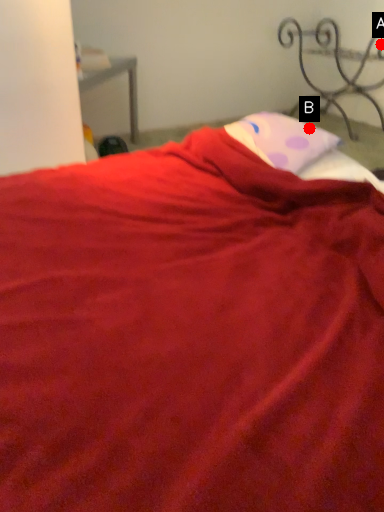
Question: Two points are circled on the image, labeled by A and B beside each circle. Which point is farther to the camera?

Choices:
 (A) A is further
 (B) B is further

Answer: (A)